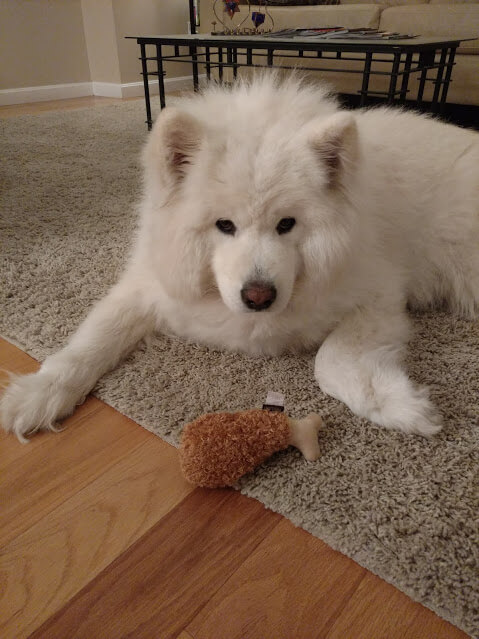
Where is `white baseboard trim`? white baseboard trim is located at coordinates (68, 87).